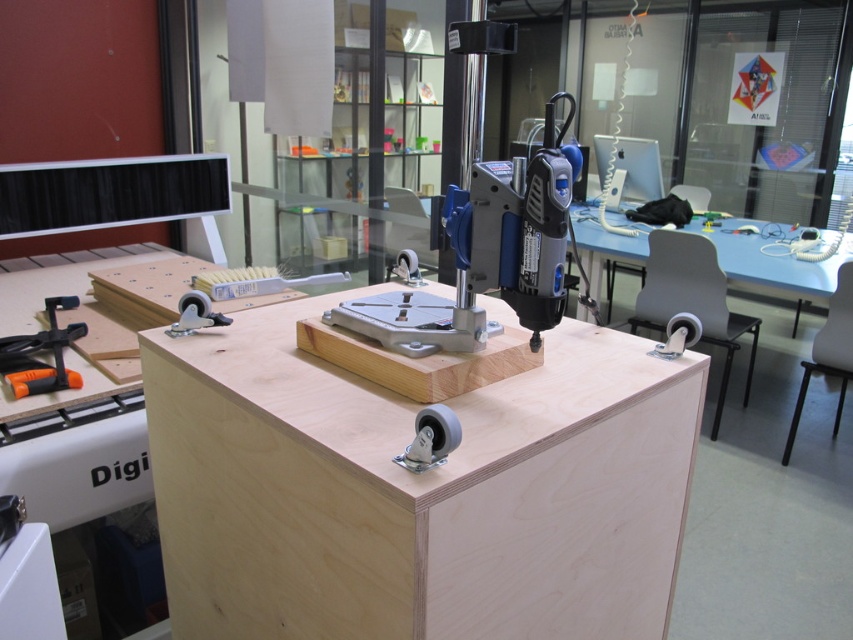
Question: Which is nearer to the light blue plastic table at center?

Choices:
 (A) orange plastic clamp at lower left
 (B) blue plastic drill at center

Answer: (B)

Question: Considering the relative positions of plywood table at center and orange plastic clamp at lower left in the image provided, where is plywood table at center located with respect to orange plastic clamp at lower left?

Choices:
 (A) right
 (B) left

Answer: (A)

Question: Which object is the closest to the orange plastic clamp at lower left?

Choices:
 (A) light blue plastic table at center
 (B) blue plastic drill at center
 (C) plywood table at center

Answer: (C)

Question: Can you confirm if plywood table at center is positioned to the right of light blue plastic table at center?

Choices:
 (A) yes
 (B) no

Answer: (B)

Question: Considering the relative positions of light blue plastic table at center and orange plastic clamp at lower left in the image provided, where is light blue plastic table at center located with respect to orange plastic clamp at lower left?

Choices:
 (A) right
 (B) left

Answer: (A)

Question: Which point appears closest to the camera in this image?

Choices:
 (A) (62, 346)
 (B) (492, 388)
 (C) (759, 227)
 (D) (380, 330)

Answer: (B)